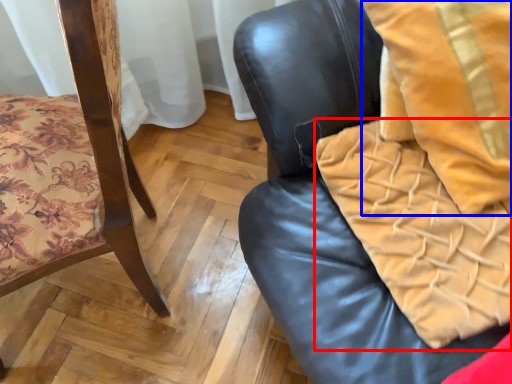
Question: Which point is closer to the camera, blanket (highlighted by a red box) or throw pillow (highlighted by a blue box)?

Choices:
 (A) blanket
 (B) throw pillow

Answer: (B)